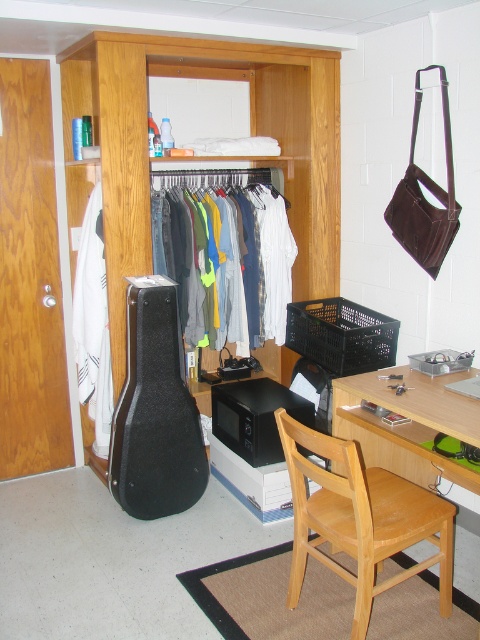
Question: Does black hard case guitar at lower left lie behind white fabric at left?

Choices:
 (A) yes
 (B) no

Answer: (B)

Question: Which point is closer to the camera taking this photo?

Choices:
 (A) (343, 417)
 (B) (360, 630)
 (C) (141, 280)

Answer: (B)

Question: Is denim jeans at center below black hard case guitar at lower left?

Choices:
 (A) yes
 (B) no

Answer: (B)

Question: Which point appears farthest from the camera in this image?

Choices:
 (A) (164, 259)
 (B) (85, 244)

Answer: (A)

Question: Which object is positioned closest to the wooden chair at lower center?

Choices:
 (A) white fabric at left
 (B) denim jeans at center

Answer: (B)

Question: Does denim jeans at center have a lesser width compared to white fabric at left?

Choices:
 (A) yes
 (B) no

Answer: (B)